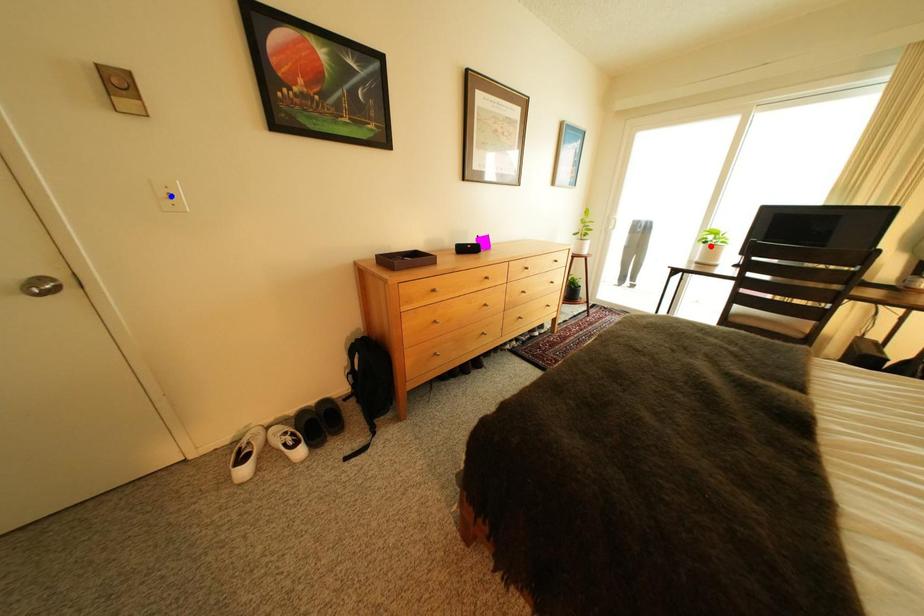
Question: Which of the two points in the image is closer to the camera?

Choices:
 (A) Blue point is closer.
 (B) Red point is closer.

Answer: (A)